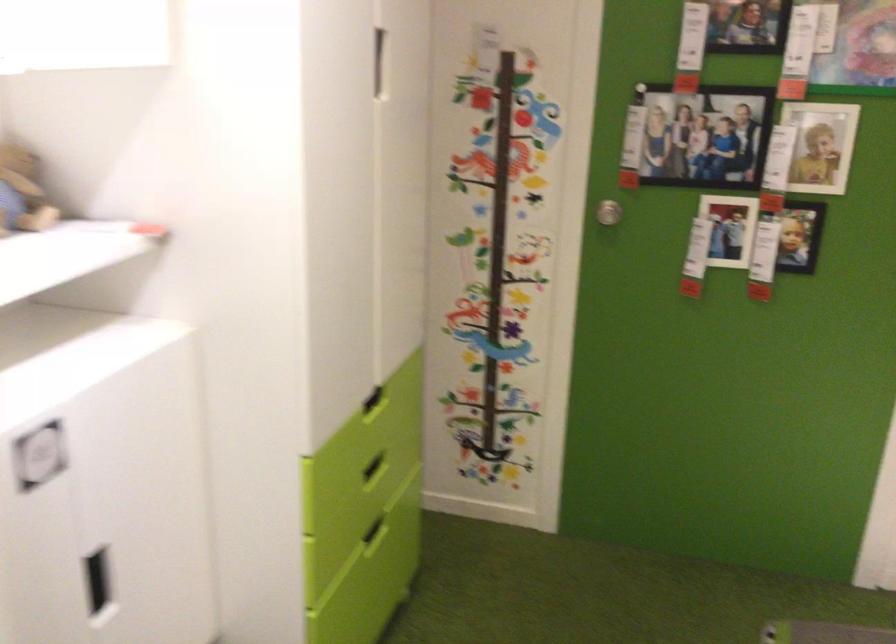
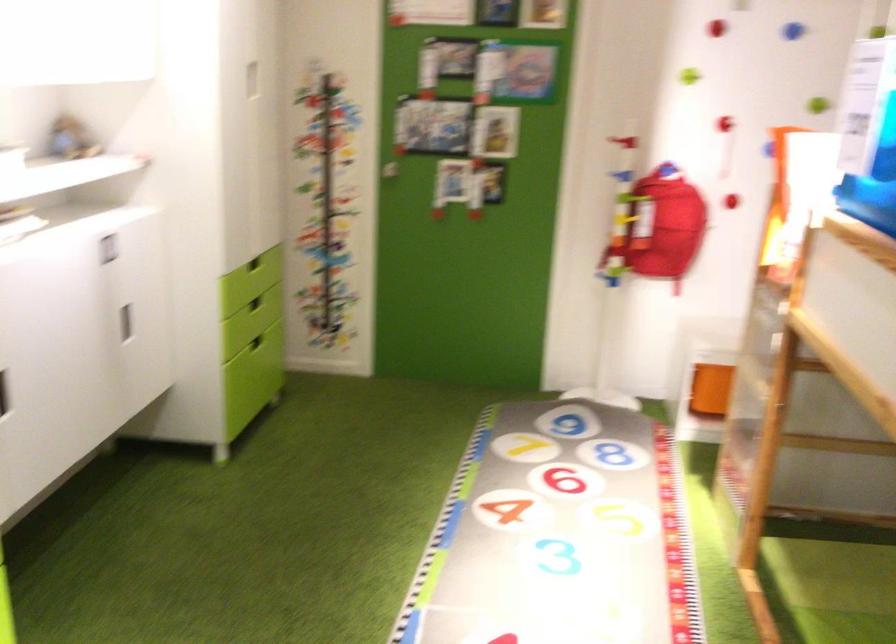
Where in the second image is the point corresponding to pixel 371 471 from the first image?

(254, 303)